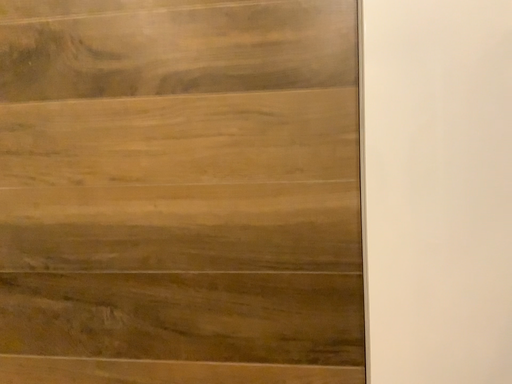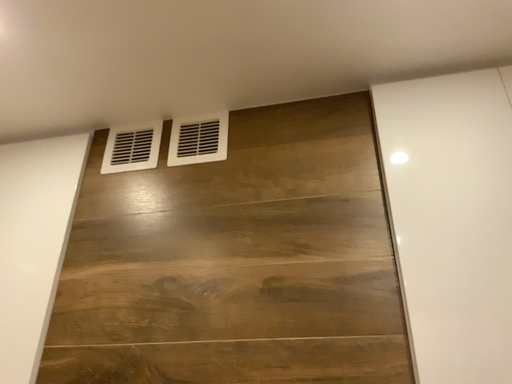
Question: How did the camera likely rotate when shooting the video?

Choices:
 (A) rotated upward
 (B) rotated downward

Answer: (A)